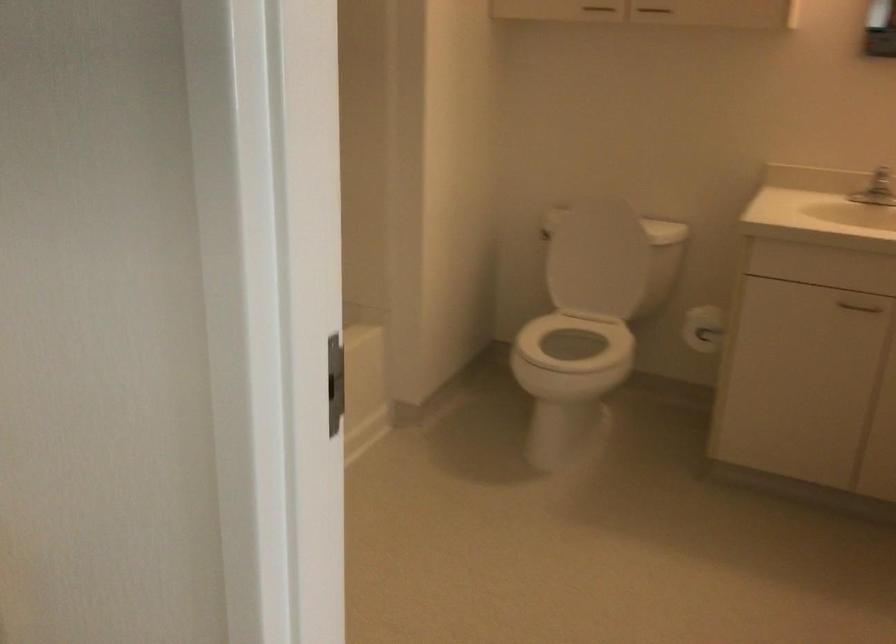
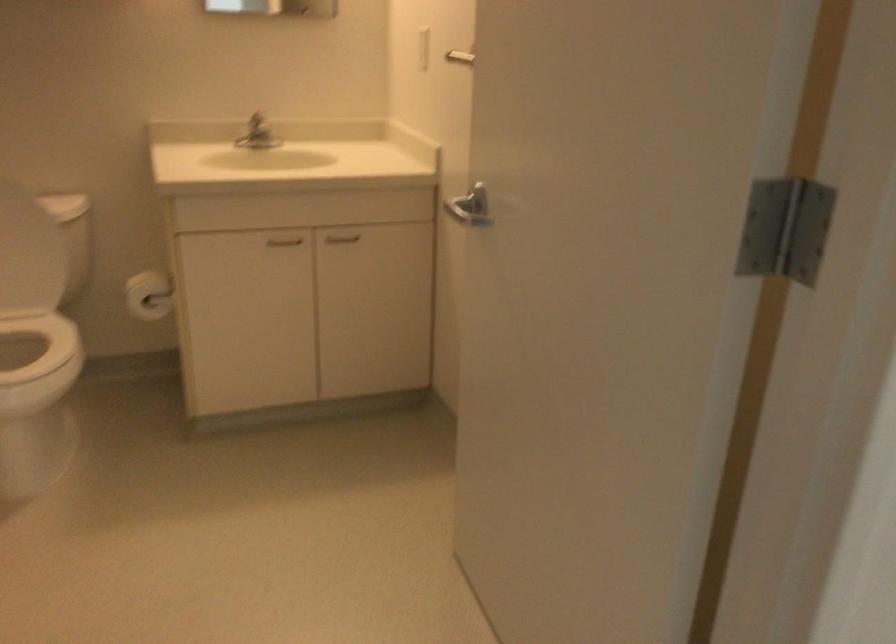
The point at (610, 234) is marked in the first image. Where is the corresponding point in the second image?

(12, 210)